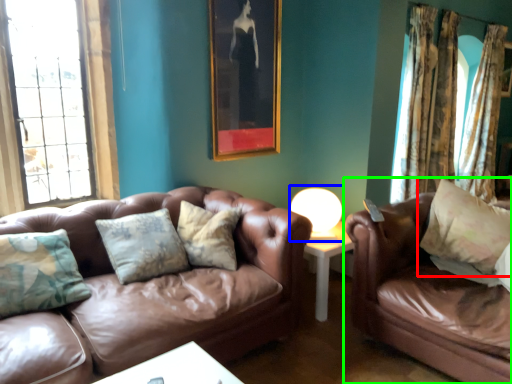
Question: Which object is the closest to the pillow (highlighted by a red box)? Choose among these: table lamp (highlighted by a blue box) or studio couch (highlighted by a green box).

Choices:
 (A) table lamp
 (B) studio couch

Answer: (B)